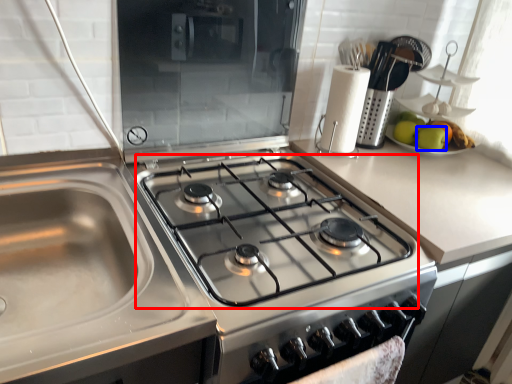
Question: Which of the following is the closest to the observer, gas stove (highlighted by a red box) or apple (highlighted by a blue box)?

Choices:
 (A) gas stove
 (B) apple

Answer: (A)